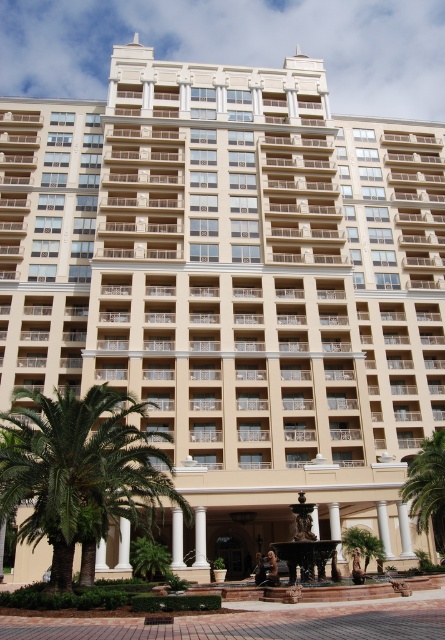
Question: Is green leafy palm tree at lower left to the left of green leafy palm tree at center from the viewer's perspective?

Choices:
 (A) no
 (B) yes

Answer: (B)

Question: Among these points, which one is nearest to the camera?

Choices:
 (A) (36, 515)
 (B) (444, 458)

Answer: (A)

Question: Which object is closer to the camera taking this photo?

Choices:
 (A) green leafy palm tree at lower left
 (B) green leafy palm tree at center

Answer: (A)

Question: Can you confirm if green leafy palm tree at lower left is positioned to the left of green leafy palm tree at center?

Choices:
 (A) yes
 (B) no

Answer: (A)

Question: Observing the image, what is the correct spatial positioning of green leafy palm tree at lower left in reference to green leafy palm tree at center?

Choices:
 (A) above
 (B) below

Answer: (A)

Question: Which object is closer to the camera taking this photo?

Choices:
 (A) green leafy palm tree at center
 (B) green leafy palm tree at lower left

Answer: (B)